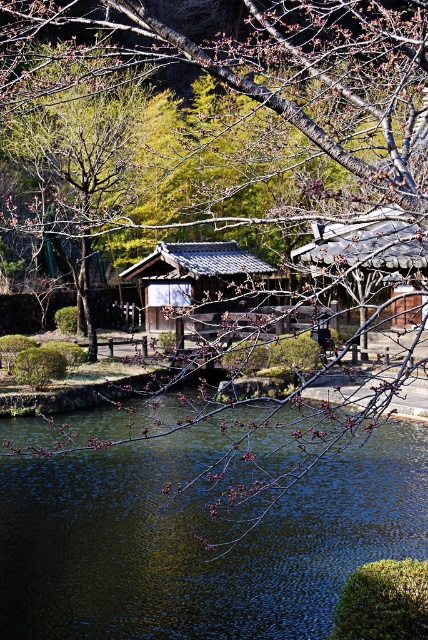
Is shiny dark water at center smaller than matte gray wooden hut at center?

Yes, shiny dark water at center is smaller than matte gray wooden hut at center.

Is shiny dark water at center positioned behind matte gray wooden hut at center?

Yes, it is.

Is point (321, 502) closer to viewer compared to point (184, 307)?

Yes.

The width and height of the screenshot is (428, 640). Find the location of `shiny dark water at center`. shiny dark water at center is located at coordinates (196, 541).